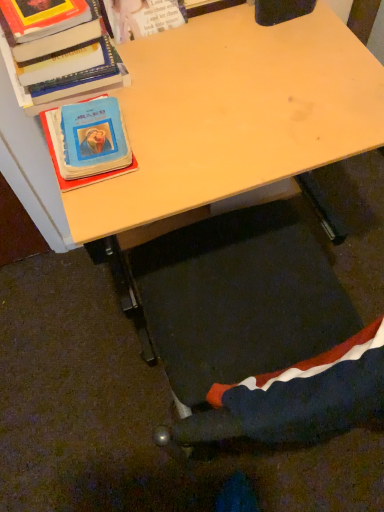
Question: From the image's perspective, relative to hardcover book at upper left, arranged as the first book when viewed from the top, is wooden desk at center above or below?

Choices:
 (A) above
 (B) below

Answer: (B)

Question: In terms of height, does wooden desk at center look taller or shorter compared to hardcover book at upper left, which is the second book in bottom-to-top order?

Choices:
 (A) tall
 (B) short

Answer: (A)

Question: Which object is positioned closest to the wooden desk at center?

Choices:
 (A) velvet-like fabric swivel chair at lower center
 (B) hardcover book at upper left, which is the second book in bottom-to-top order
 (C) blue matte book at left, arranged as the 2th book when viewed from the top

Answer: (B)

Question: Estimate the real-world distances between objects in this image. Which object is closer to the hardcover book at upper left, arranged as the first book when viewed from the top?

Choices:
 (A) velvet-like fabric swivel chair at lower center
 (B) blue matte book at left, the first book when ordered from bottom to top
 (C) wooden desk at center

Answer: (B)